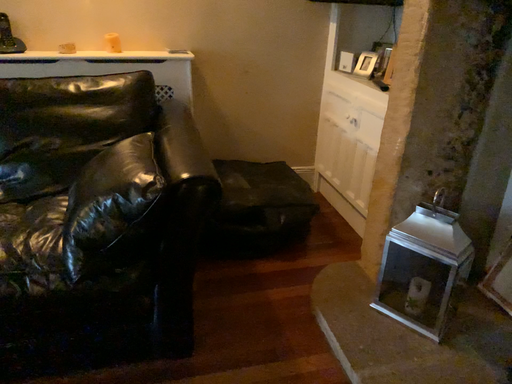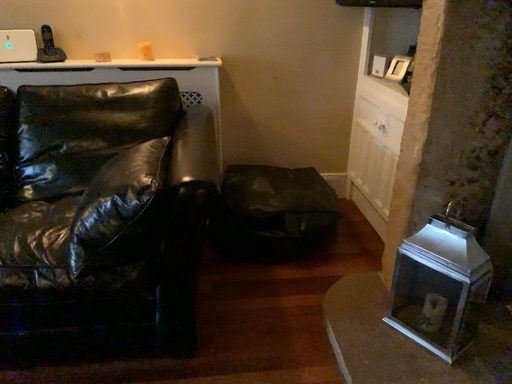
Question: How did the camera likely rotate when shooting the video?

Choices:
 (A) rotated right
 (B) rotated left

Answer: (B)